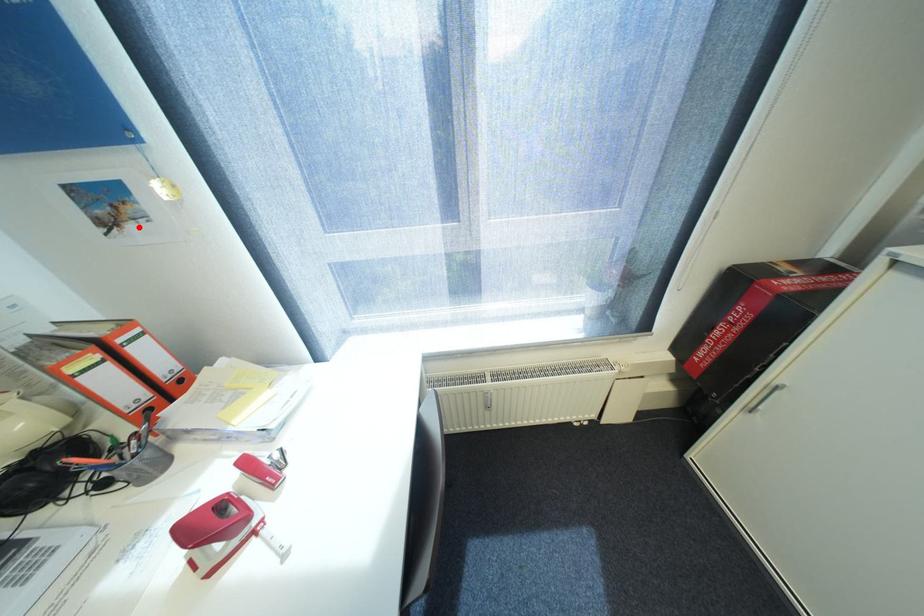
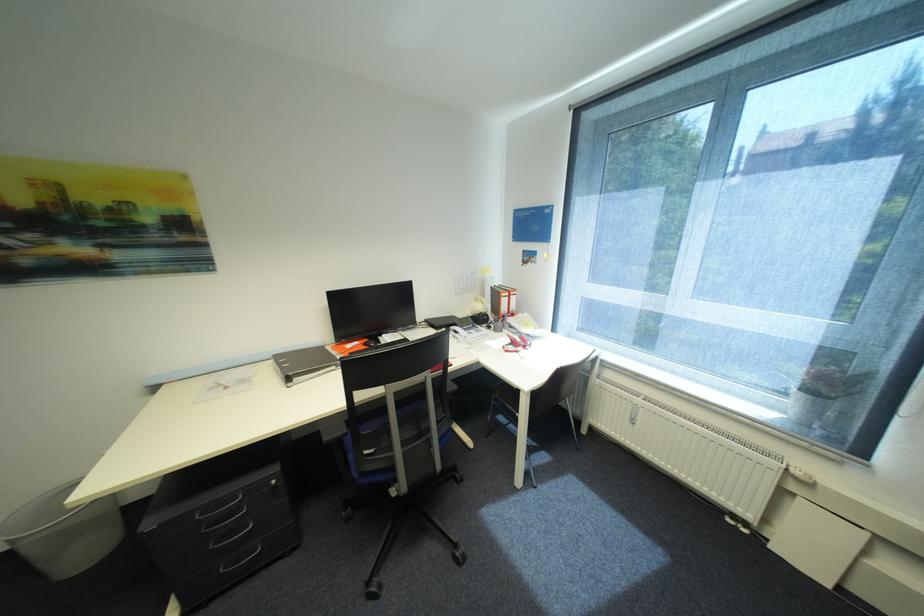
Find the pixel in the second image that matches the highlighted location in the first image.

(537, 265)